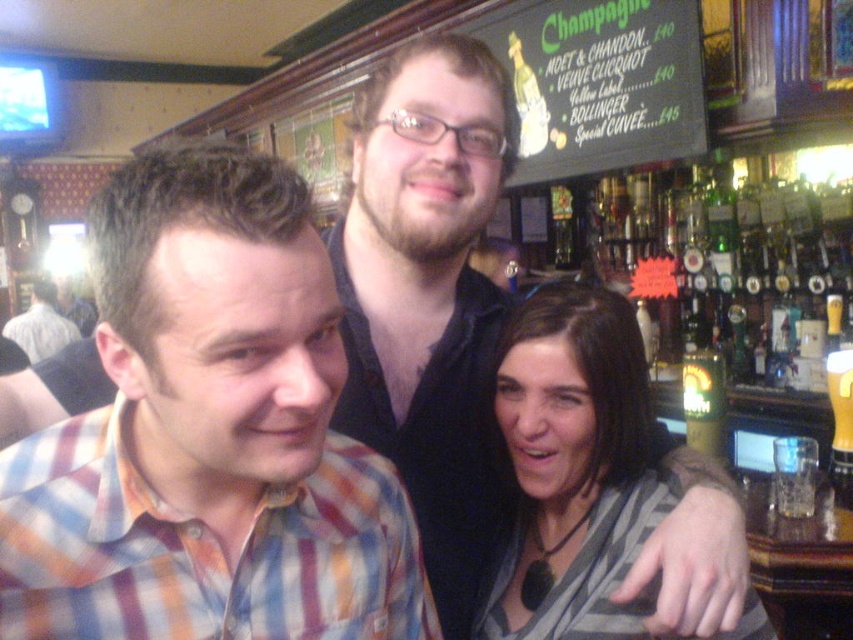
Question: Which object is closer to the camera taking this photo?

Choices:
 (A) multicolored plaid shirt at center
 (B) green glass bottle at upper right
 (C) plaid shirt at center

Answer: (A)

Question: Which object is farther from the camera taking this photo?

Choices:
 (A) multicolored plaid shirt at center
 (B) green glass bottle at upper right
 (C) gray striped scarf at center
 (D) plaid shirt at center

Answer: (D)

Question: Can you confirm if green glass bottle at upper right is bigger than translucent glass mug at upper right?

Choices:
 (A) no
 (B) yes

Answer: (B)

Question: Is multicolored plaid shirt at center positioned before green glass bottle at upper right?

Choices:
 (A) yes
 (B) no

Answer: (A)

Question: Among these points, which one is nearest to the camera?

Choices:
 (A) (51, 349)
 (B) (631, 310)
 (C) (711, 385)

Answer: (B)

Question: Does multicolored plaid shirt at center appear on the right side of green glass bottle at upper right?

Choices:
 (A) no
 (B) yes

Answer: (A)